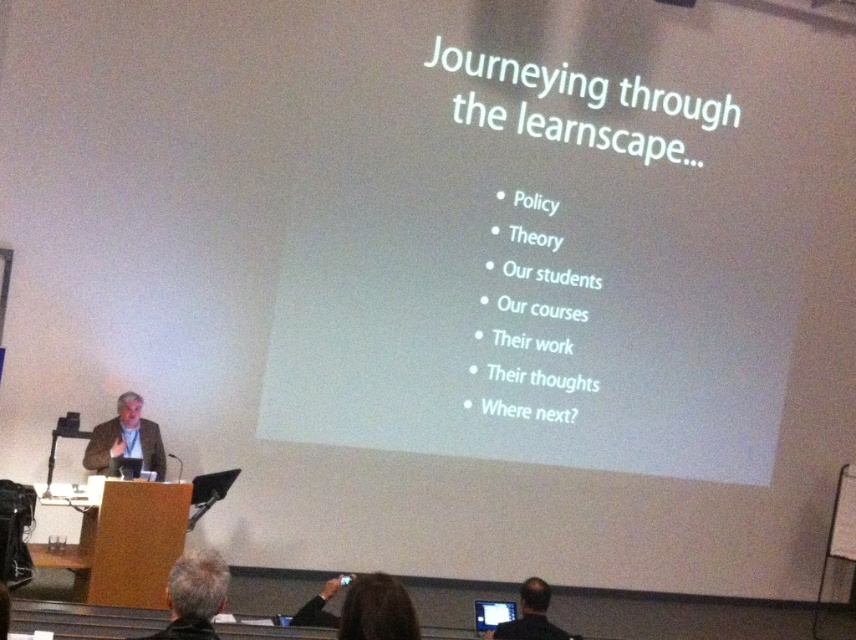
Question: Does gray hair at upper center have a greater width compared to black shirt at lower right?

Choices:
 (A) yes
 (B) no

Answer: (A)

Question: Does gray hair at upper center lie in front of beige fabric suit at left?

Choices:
 (A) yes
 (B) no

Answer: (A)

Question: In this image, where is dark brown hair at lower center located relative to gray hair at upper center?

Choices:
 (A) above
 (B) below

Answer: (B)

Question: Which object is closer to the camera taking this photo?

Choices:
 (A) dark brown hair at lower center
 (B) black shirt at lower right
 (C) gray hair at upper center

Answer: (C)

Question: Which of the following is the closest to the observer?

Choices:
 (A) beige fabric suit at left
 (B) black shirt at lower right
 (C) dark brown hair at lower center
 (D) gray hair at upper center

Answer: (D)

Question: Which of the following is the farthest from the observer?

Choices:
 (A) black shirt at lower right
 (B) dark brown hair at lower center

Answer: (B)